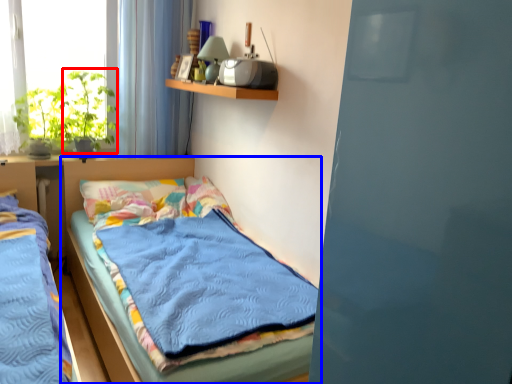
Question: Among these objects, which one is nearest to the camera, plant (highlighted by a red box) or bed (highlighted by a blue box)?

Choices:
 (A) plant
 (B) bed

Answer: (B)